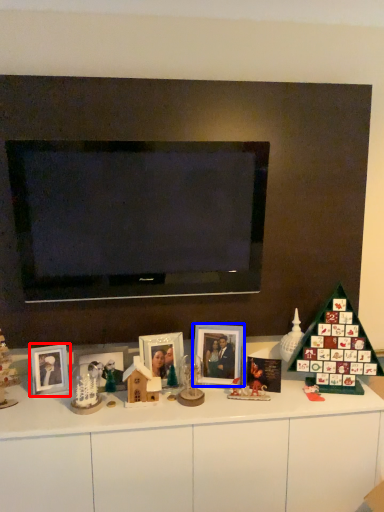
Question: Which object is further to the camera taking this photo, picture frame (highlighted by a red box) or picture frame (highlighted by a blue box)?

Choices:
 (A) picture frame
 (B) picture frame

Answer: (B)